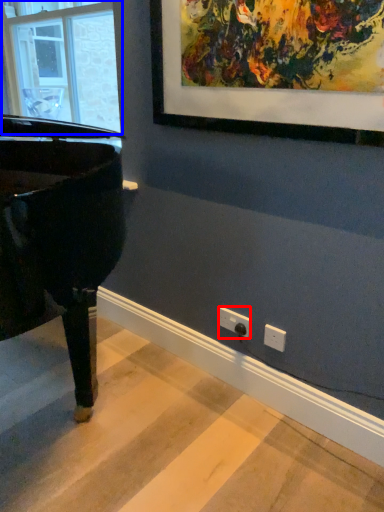
Question: Among these objects, which one is farthest to the camera, electric outlet (highlighted by a red box) or window (highlighted by a blue box)?

Choices:
 (A) electric outlet
 (B) window

Answer: (B)